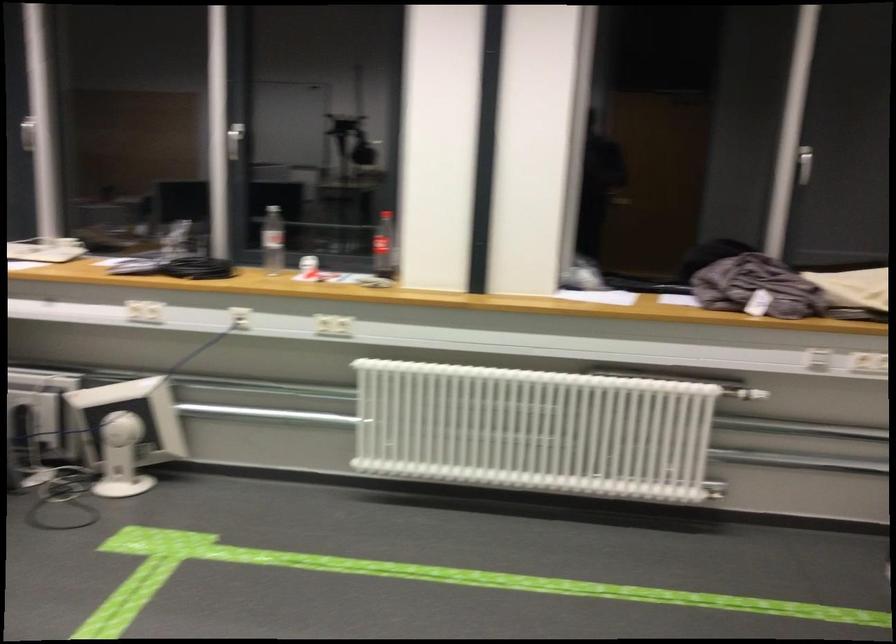
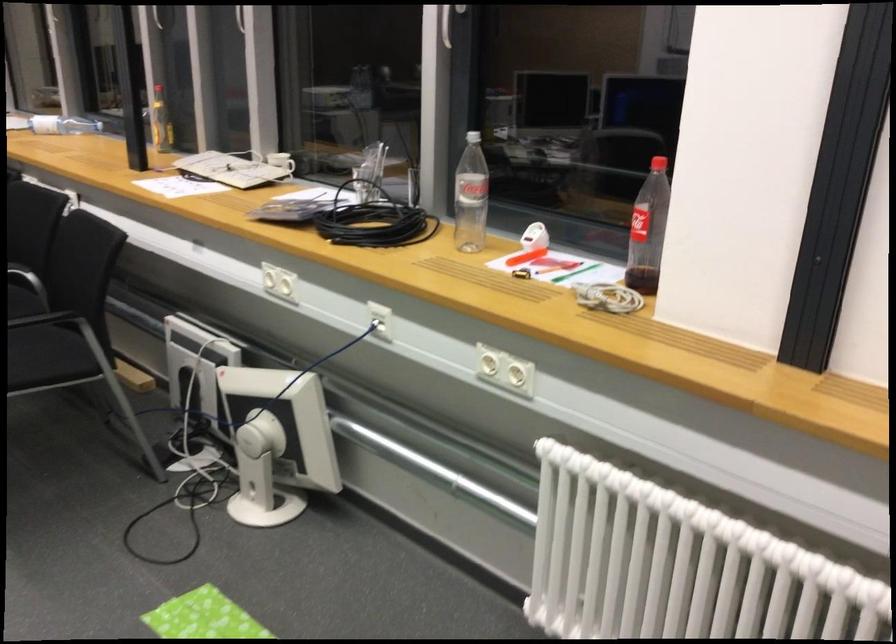
In the second image, find the point that corresponds to the point at 389,254 in the first image.

(648, 230)